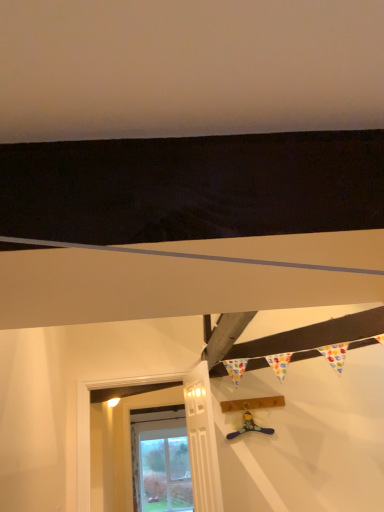
Question: Is the position of white painted wood door at lower left more distant than that of blue fabric toy at center?

Choices:
 (A) yes
 (B) no

Answer: (B)

Question: Does white painted wood door at lower left turn towards blue fabric toy at center?

Choices:
 (A) yes
 (B) no

Answer: (B)

Question: Does white painted wood door at lower left have a smaller size compared to blue fabric toy at center?

Choices:
 (A) yes
 (B) no

Answer: (B)

Question: Considering the relative positions of white painted wood door at lower left and blue fabric toy at center in the image provided, is white painted wood door at lower left to the right of blue fabric toy at center from the viewer's perspective?

Choices:
 (A) no
 (B) yes

Answer: (A)

Question: Is white painted wood door at lower left placed right next to blue fabric toy at center?

Choices:
 (A) no
 (B) yes

Answer: (A)

Question: Considering the relative positions of white painted wood door at lower left and blue fabric toy at center in the image provided, is white painted wood door at lower left in front of blue fabric toy at center?

Choices:
 (A) no
 (B) yes

Answer: (B)

Question: Could you tell me if white painted wood at lower left is facing blue fabric toy at center?

Choices:
 (A) yes
 (B) no

Answer: (B)

Question: Is white painted wood at lower left looking in the opposite direction of blue fabric toy at center?

Choices:
 (A) no
 (B) yes

Answer: (A)

Question: Is white painted wood at lower left positioned far away from blue fabric toy at center?

Choices:
 (A) yes
 (B) no

Answer: (A)

Question: Is white painted wood at lower left wider than blue fabric toy at center?

Choices:
 (A) yes
 (B) no

Answer: (A)

Question: From the image's perspective, is white painted wood at lower left located above blue fabric toy at center?

Choices:
 (A) no
 (B) yes

Answer: (A)

Question: Considering the relative sizes of white painted wood at lower left and blue fabric toy at center in the image provided, is white painted wood at lower left shorter than blue fabric toy at center?

Choices:
 (A) no
 (B) yes

Answer: (A)

Question: Is white painted wood at lower left at the left side of white painted wood door at lower left?

Choices:
 (A) no
 (B) yes

Answer: (B)